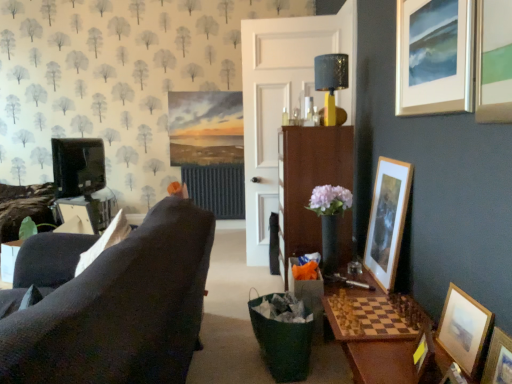
Identify the location of wooden picture frame at lower right, arranged as the 5th picture frame when viewed from the top. (498, 359).

The width and height of the screenshot is (512, 384). What do you see at coordinates (498, 359) in the screenshot? I see `wooden picture frame at lower right, arranged as the 5th picture frame when viewed from the top` at bounding box center [498, 359].

What do you see at coordinates (331, 81) in the screenshot? I see `shiny metallic lampshade at upper center` at bounding box center [331, 81].

What are the coordinates of `brown wood cabinet at center` in the screenshot? It's located at (308, 183).

Find the location of a particular element. Image resolution: width=512 pixels, height=384 pixels. silver metallic picture frame at upper right, placed as the 1th picture frame when sorted from top to bottom is located at coordinates [x=434, y=56].

In the image, is wooden picture frame at lower right, the fourth picture frame when ordered from bottom to top, positioned in front of or behind shiny metallic lampshade at upper center?

wooden picture frame at lower right, the fourth picture frame when ordered from bottom to top, is positioned closer to the viewer than shiny metallic lampshade at upper center.

Considering the relative sizes of wooden picture frame at lower right, the fourth picture frame when ordered from bottom to top, and shiny metallic lampshade at upper center in the image provided, is wooden picture frame at lower right, the fourth picture frame when ordered from bottom to top, wider than shiny metallic lampshade at upper center?

In fact, wooden picture frame at lower right, the fourth picture frame when ordered from bottom to top, might be narrower than shiny metallic lampshade at upper center.

Measure the distance between wooden picture frame at lower right, the fourth picture frame when ordered from bottom to top, and shiny metallic lampshade at upper center.

wooden picture frame at lower right, the fourth picture frame when ordered from bottom to top, and shiny metallic lampshade at upper center are 5.52 feet apart from each other.

Is wooden picture frame at lower right, arranged as the 3th picture frame when viewed from the top, oriented away from shiny metallic lampshade at upper center?

That's not correct — wooden picture frame at lower right, arranged as the 3th picture frame when viewed from the top, is not looking away from shiny metallic lampshade at upper center.

From the image's perspective, which one is positioned lower, shiny metallic lampshade at upper center or wooden picture frame at lower right, arranged as the 5th picture frame when viewed from the top?

wooden picture frame at lower right, arranged as the 5th picture frame when viewed from the top, from the image's perspective.

Considering the positions of objects shiny metallic lampshade at upper center and wooden picture frame at lower right, arranged as the 5th picture frame when viewed from the top, in the image provided, who is more to the right, shiny metallic lampshade at upper center or wooden picture frame at lower right, arranged as the 5th picture frame when viewed from the top,?

wooden picture frame at lower right, arranged as the 5th picture frame when viewed from the top, is more to the right.

From a real-world perspective, which object stands above the other?

From a 3D spatial view, shiny metallic lampshade at upper center is above.

Consider the image. Which point is more distant from viewer, [332,86] or [495,373]?

The point [332,86] is farther from the camera.

Between white wooden door at center and shiny metallic lampshade at upper center, which one has less height?

shiny metallic lampshade at upper center.

Considering the positions of points (255, 170) and (342, 68), is point (255, 170) closer to camera compared to point (342, 68)?

No, (255, 170) is behind (342, 68).

Are white wooden door at center and shiny metallic lampshade at upper center located far from each other?

No, there isn't a large distance between white wooden door at center and shiny metallic lampshade at upper center.

Is white wooden door at center oriented away from shiny metallic lampshade at upper center?

Yes, white wooden door at center is positioned with its back facing shiny metallic lampshade at upper center.

Is point (272, 179) farther from viewer compared to point (414, 358)?

That is True.

Looking at the image, does white wooden door at center seem bigger or smaller compared to wooden picture frame at lower right, the 3th picture frame when ordered from bottom to top?

In the image, white wooden door at center appears to be larger than wooden picture frame at lower right, the 3th picture frame when ordered from bottom to top.

Is white wooden door at center thinner than wooden picture frame at lower right, placed as the 4th picture frame when sorted from top to bottom?

In fact, white wooden door at center might be wider than wooden picture frame at lower right, placed as the 4th picture frame when sorted from top to bottom.

Is white wooden door at center turned away from wooden picture frame at lower right, placed as the 4th picture frame when sorted from top to bottom?

No, white wooden door at center's orientation is not away from wooden picture frame at lower right, placed as the 4th picture frame when sorted from top to bottom.

From the image's perspective, is wooden picture frame at lower right, arranged as the 3th picture frame when viewed from the top, over wooden picture frame at lower right, placed as the 4th picture frame when sorted from top to bottom?

Yes, from the image's perspective, wooden picture frame at lower right, arranged as the 3th picture frame when viewed from the top, is on top of wooden picture frame at lower right, placed as the 4th picture frame when sorted from top to bottom.

Based on the photo, from a real-world perspective, is wooden picture frame at lower right, the fourth picture frame when ordered from bottom to top, under wooden picture frame at lower right, placed as the 4th picture frame when sorted from top to bottom?

Actually, wooden picture frame at lower right, the fourth picture frame when ordered from bottom to top, is physically above wooden picture frame at lower right, placed as the 4th picture frame when sorted from top to bottom, in the real world.

Does point (471, 346) come closer to viewer compared to point (421, 348)?

Yes.

Is wooden picture frame at lower right, arranged as the 3th picture frame when viewed from the top, wider or thinner than wooden picture frame at lower right, placed as the 4th picture frame when sorted from top to bottom?

In the image, wooden picture frame at lower right, arranged as the 3th picture frame when viewed from the top, appears to be more narrow than wooden picture frame at lower right, placed as the 4th picture frame when sorted from top to bottom.

Is white wooden door at center looking in the opposite direction of wooden framed picture at right, placed as the fifth picture frame when sorted from bottom to top?

No, white wooden door at center is not facing the opposite direction of wooden framed picture at right, placed as the fifth picture frame when sorted from bottom to top.

Is point (270, 172) in front of point (396, 264)?

No, (270, 172) is behind (396, 264).

Which of these two, white wooden door at center or wooden framed picture at right, which ranks as the second picture frame in top-to-bottom order, stands shorter?

Standing shorter between the two is wooden framed picture at right, which ranks as the second picture frame in top-to-bottom order.

Is wooden picture frame at lower right, the 3th picture frame when ordered from bottom to top, turned away from wooden framed picture at right, which ranks as the second picture frame in top-to-bottom order?

No, wooden picture frame at lower right, the 3th picture frame when ordered from bottom to top, is not facing the opposite direction of wooden framed picture at right, which ranks as the second picture frame in top-to-bottom order.

Is point (429, 339) closer or farther from the camera than point (383, 203)?

Point (429, 339) is closer to the camera than point (383, 203).

Between wooden picture frame at lower right, placed as the 4th picture frame when sorted from top to bottom, and wooden framed picture at right, which ranks as the second picture frame in top-to-bottom order, which one appears on the right side from the viewer's perspective?

From the viewer's perspective, wooden framed picture at right, which ranks as the second picture frame in top-to-bottom order, appears more on the right side.

In the scene shown: Is wooden picture frame at lower right, placed as the 4th picture frame when sorted from top to bottom, in front of wooden framed picture at right, which ranks as the second picture frame in top-to-bottom order?

Yes, it is in front of wooden framed picture at right, which ranks as the second picture frame in top-to-bottom order.

Locate an element on the screen. Image resolution: width=512 pixels, height=384 pixels. the 2nd picture frame positioned below the shiny metallic lampshade at upper center (from a real-world perspective) is located at coordinates (464, 330).

Find the location of `picture frame that is the 6th object located in front of the shiny metallic lampshade at upper center`. picture frame that is the 6th object located in front of the shiny metallic lampshade at upper center is located at coordinates (498, 359).

Consider the image. Based on their spatial positions, is wooden picture frame at lower right, arranged as the 3th picture frame when viewed from the top, or wooden framed picture at right, placed as the fifth picture frame when sorted from bottom to top, closer to wooden picture frame at lower right, marked as the 2th picture frame in a bottom-to-top arrangement?

wooden picture frame at lower right, arranged as the 3th picture frame when viewed from the top.

Based on their spatial positions, is wooden framed picture at right, placed as the fifth picture frame when sorted from bottom to top, or silver metallic picture frame at upper right, placed as the 1th picture frame when sorted from top to bottom, closer to white wooden door at center?

Among the two, wooden framed picture at right, placed as the fifth picture frame when sorted from bottom to top, is located nearer to white wooden door at center.

Looking at the image, which one is located closer to shiny metallic lampshade at upper center, wooden picture frame at lower right, placed as the 4th picture frame when sorted from top to bottom, or white wooden door at center?

The object closer to shiny metallic lampshade at upper center is white wooden door at center.

Looking at the image, which one is located closer to brown wood cabinet at center, wooden picture frame at lower right, arranged as the 3th picture frame when viewed from the top, or wooden picture frame at lower right, marked as the 2th picture frame in a bottom-to-top arrangement?

wooden picture frame at lower right, arranged as the 3th picture frame when viewed from the top.

Considering their positions, is wooden picture frame at lower right, placed as the sixth picture frame when sorted from top to bottom, positioned further to brown wood cabinet at center than silver metallic picture frame at upper right, placed as the 1th picture frame when sorted from top to bottom?

Based on the image, wooden picture frame at lower right, placed as the sixth picture frame when sorted from top to bottom, appears to be further to brown wood cabinet at center.

Looking at the image, which one is located further to brown wood cabinet at center, white wooden door at center or silver metallic picture frame at upper right, placed as the 1th picture frame when sorted from top to bottom?

Among the two, silver metallic picture frame at upper right, placed as the 1th picture frame when sorted from top to bottom, is located further to brown wood cabinet at center.

Based on their spatial positions, is white wooden door at center or silver metallic picture frame at upper right, arranged as the 6th picture frame when ordered from the bottom, further from wooden picture frame at lower right, the 3th picture frame when ordered from bottom to top?

Based on the image, white wooden door at center appears to be further to wooden picture frame at lower right, the 3th picture frame when ordered from bottom to top.

From the image, which object appears to be nearer to wooden framed picture at right, which ranks as the second picture frame in top-to-bottom order, wooden picture frame at lower right, marked as the 2th picture frame in a bottom-to-top arrangement, or shiny metallic lampshade at upper center?

Based on the image, shiny metallic lampshade at upper center appears to be nearer to wooden framed picture at right, which ranks as the second picture frame in top-to-bottom order.

Locate an element on the screen. The image size is (512, 384). cabinetry between wooden picture frame at lower right, arranged as the 5th picture frame when viewed from the top, and shiny metallic lampshade at upper center from front to back is located at coordinates (308, 183).

Locate an element on the screen. Image resolution: width=512 pixels, height=384 pixels. lamp between wooden picture frame at lower right, the 3th picture frame when ordered from bottom to top, and white wooden door at center, along the z-axis is located at coordinates (331, 81).

The width and height of the screenshot is (512, 384). I want to click on picture frame located between wooden picture frame at lower right, which is the first picture frame in bottom-to-top order, and wooden picture frame at lower right, the fourth picture frame when ordered from bottom to top, in the depth direction, so click(423, 352).

The image size is (512, 384). I want to click on lamp between wooden framed picture at right, which ranks as the second picture frame in top-to-bottom order, and white wooden door at center from front to back, so click(331, 81).